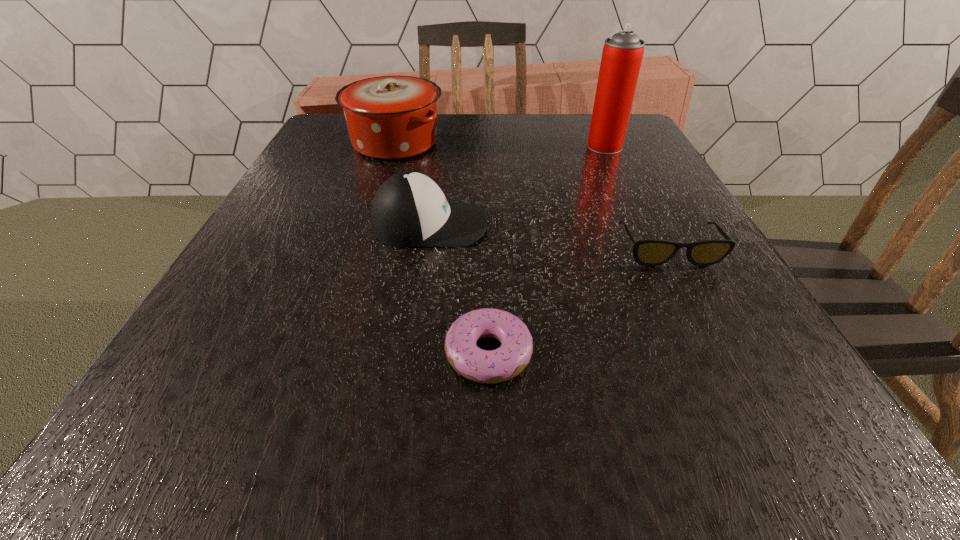
The width and height of the screenshot is (960, 540). I want to click on free point between the doughnut and the fourth shortest object, so click(x=442, y=247).

Find the location of a particular element. Image resolution: width=960 pixels, height=540 pixels. blank region between the aerosol can and the doughnut is located at coordinates (546, 249).

Find the location of a particular element. This screenshot has height=540, width=960. object that stands as the closest to the sunglasses is located at coordinates (487, 367).

The width and height of the screenshot is (960, 540). In order to click on object that is the second closest to the nearest object in this screenshot , I will do `click(651, 252)`.

Locate an element on the screen. The width and height of the screenshot is (960, 540). vacant space that satisfies the following two spatial constraints: 1. on the front side of the tallest object; 2. on the left side of the casserole is located at coordinates (395, 146).